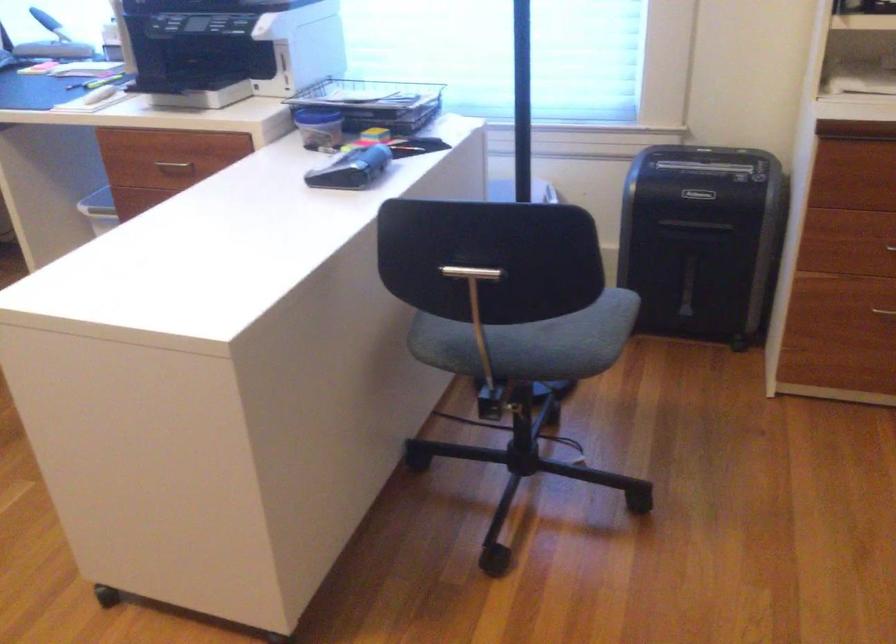
This screenshot has height=644, width=896. I want to click on wire paper tray, so click(374, 102).